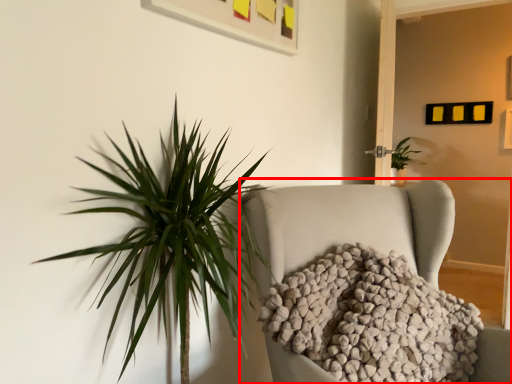
Question: From the image's perspective, what is the correct spatial relationship of furniture (annotated by the red box) in relation to houseplant?

Choices:
 (A) above
 (B) below

Answer: (B)